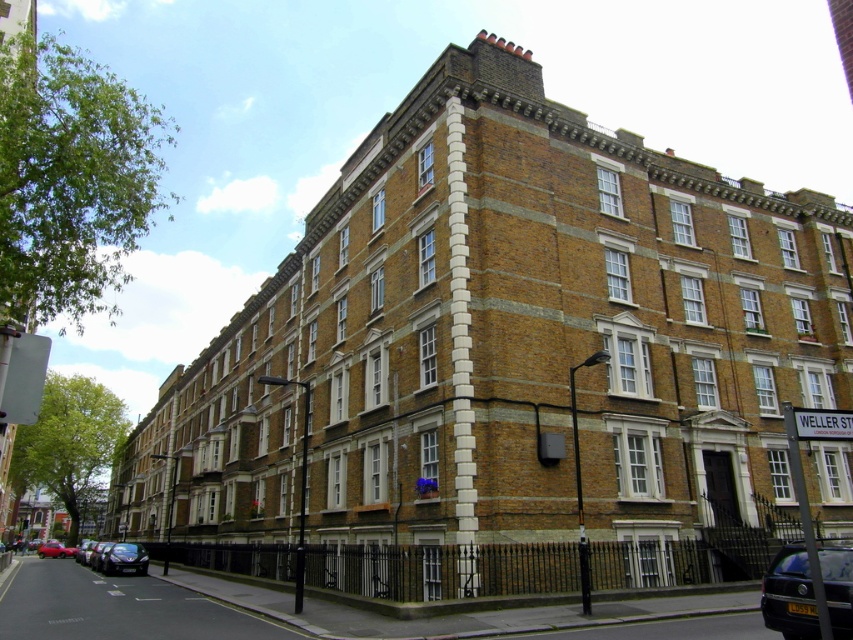
Question: Can you confirm if black metallic car at lower right is positioned above shiny black car at lower left?

Choices:
 (A) no
 (B) yes

Answer: (B)

Question: Is shiny black car at lower left positioned before shiny red car at lower left?

Choices:
 (A) no
 (B) yes

Answer: (B)

Question: Which object appears farthest from the camera in this image?

Choices:
 (A) black metallic car at lower right
 (B) shiny red car at lower left
 (C) shiny black car at lower left

Answer: (B)

Question: Among these objects, which one is farthest from the camera?

Choices:
 (A) black metallic car at lower right
 (B) shiny black car at lower left
 (C) shiny red car at lower left

Answer: (C)

Question: Estimate the real-world distances between objects in this image. Which object is farther from the shiny red car at lower left?

Choices:
 (A) black metallic car at lower right
 (B) shiny black car at lower left

Answer: (A)

Question: Does shiny black car at lower left appear on the right side of shiny red car at lower left?

Choices:
 (A) no
 (B) yes

Answer: (B)